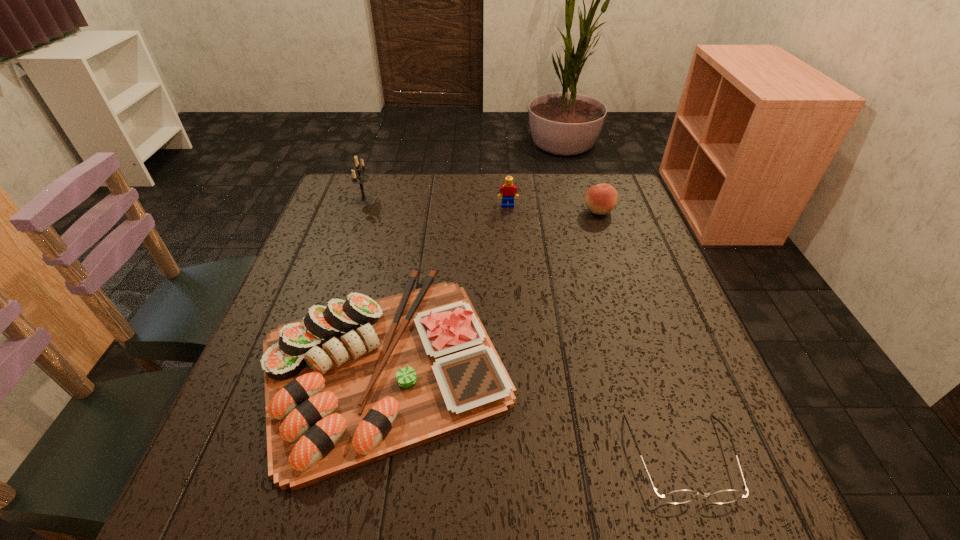
What are the coordinates of `vacant area that lies between the platter and the shortest object` in the screenshot? It's located at (534, 410).

Locate an element on the screen. The image size is (960, 540). free space between the candle holder and the platter is located at coordinates (375, 282).

Image resolution: width=960 pixels, height=540 pixels. Identify the location of empty space that is in between the spectacles and the candle holder. (523, 329).

The width and height of the screenshot is (960, 540). I want to click on vacant space in between the platter and the spectacles, so click(534, 410).

Locate an element on the screen. The height and width of the screenshot is (540, 960). vacant area that lies between the spectacles and the platter is located at coordinates (534, 410).

Where is `free space between the platter and the tallest object`? This screenshot has height=540, width=960. free space between the platter and the tallest object is located at coordinates (375, 282).

Where is `vacant region between the candle holder and the second tallest object`? Image resolution: width=960 pixels, height=540 pixels. vacant region between the candle holder and the second tallest object is located at coordinates (436, 203).

Locate an element on the screen. This screenshot has width=960, height=540. object that ranks as the fourth closest to the second tallest object is located at coordinates (679, 496).

This screenshot has height=540, width=960. Find the location of `object that is the closest one to the fourth shortest object`. object that is the closest one to the fourth shortest object is located at coordinates (600, 199).

Image resolution: width=960 pixels, height=540 pixels. Find the location of `vacant space that satisfies the following two spatial constraints: 1. on the front side of the tallest object; 2. on the left side of the peach`. vacant space that satisfies the following two spatial constraints: 1. on the front side of the tallest object; 2. on the left side of the peach is located at coordinates (361, 211).